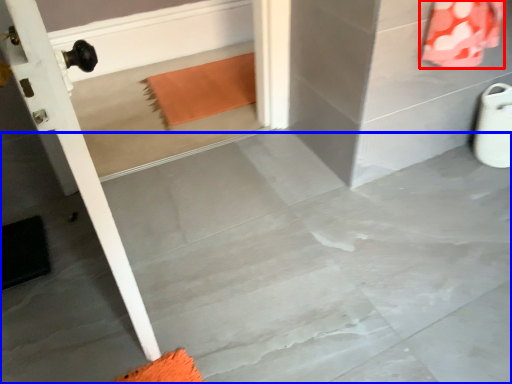
Question: Among these objects, which one is nearest to the camera, material (highlighted by a red box) or concrete (highlighted by a blue box)?

Choices:
 (A) material
 (B) concrete

Answer: (B)